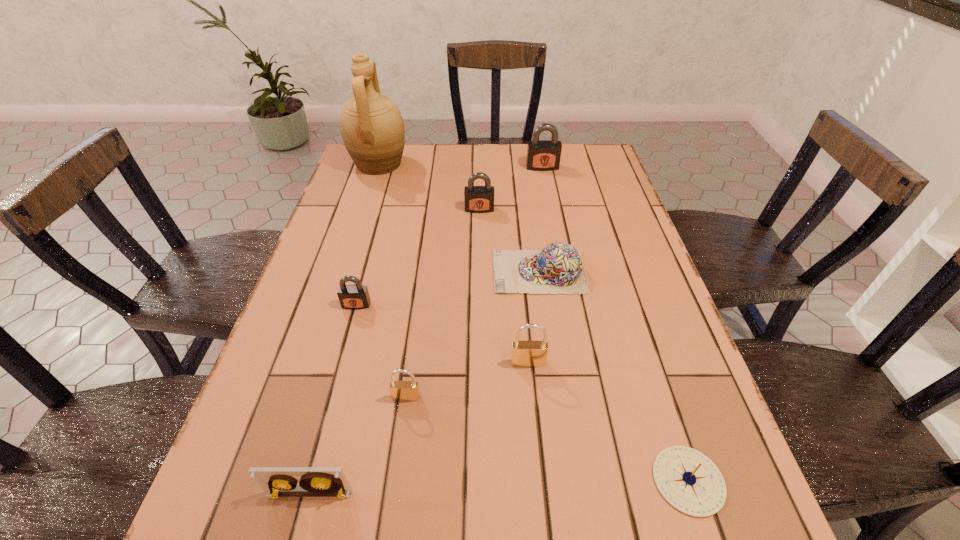
Identify which gray padlock is the third closest to the cap. Please provide its 2D coordinates. Your answer should be formatted as a tuple, i.e. [(x, y)], where the tuple contains the x and y coordinates of a point satisfying the conditions above.

[(542, 155)]

Select which gray padlock appears as the closest to the videotape. Please provide its 2D coordinates. Your answer should be formatted as a tuple, i.e. [(x, y)], where the tuple contains the x and y coordinates of a point satisfying the conditions above.

[(354, 297)]

This screenshot has height=540, width=960. Find the location of `free location that satisfies the following two spatial constraints: 1. on the front of the shortest object near the keyhole; 2. on the left side of the farthest gray padlock`. free location that satisfies the following two spatial constraints: 1. on the front of the shortest object near the keyhole; 2. on the left side of the farthest gray padlock is located at coordinates [604, 481].

Find the location of `vacant region that satisfies the following two spatial constraints: 1. on the front of the rightmost padlock near the keyhole; 2. on the front, side, and top of the cap`. vacant region that satisfies the following two spatial constraints: 1. on the front of the rightmost padlock near the keyhole; 2. on the front, side, and top of the cap is located at coordinates (563, 272).

Find the location of `vacant space that satisfies the following two spatial constraints: 1. on the front, side, and top of the fourth farthest object; 2. on the front-facing side of the second nearest padlock`. vacant space that satisfies the following two spatial constraints: 1. on the front, side, and top of the fourth farthest object; 2. on the front-facing side of the second nearest padlock is located at coordinates (552, 363).

What are the coordinates of `blank area in the image that satisfies the following two spatial constraints: 1. on the front-facing side of the nearer brass padlock; 2. on the left side of the blue compass` in the screenshot? It's located at (396, 481).